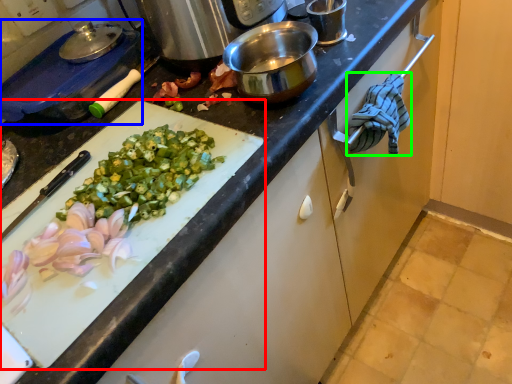
Question: Which is farther away from cutting board (highlighted by a red box)? kitchen appliance (highlighted by a blue box) or cloth (highlighted by a green box)?

Choices:
 (A) kitchen appliance
 (B) cloth

Answer: (B)